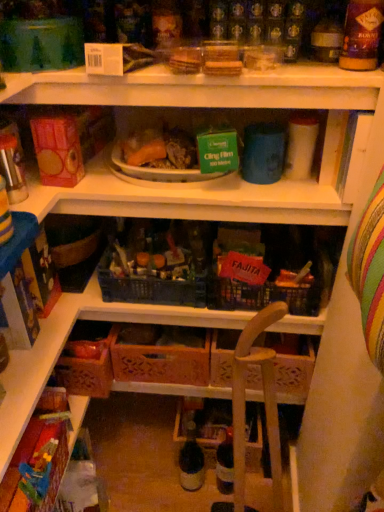
Question: Would you say translucent glass bottle at center contains orange plastic bowl at center?

Choices:
 (A) yes
 (B) no

Answer: (B)

Question: From the image's perspective, is translucent glass bottle at center located beneath orange plastic bowl at center?

Choices:
 (A) no
 (B) yes

Answer: (B)

Question: Does translucent glass bottle at center appear on the right side of orange plastic bowl at center?

Choices:
 (A) yes
 (B) no

Answer: (A)

Question: Is translucent glass bottle at center bigger than orange plastic bowl at center?

Choices:
 (A) yes
 (B) no

Answer: (B)

Question: Is translucent glass bottle at center turned away from orange plastic bowl at center?

Choices:
 (A) no
 (B) yes

Answer: (A)

Question: Could you tell me if translucent glass bottle at center is facing orange plastic bowl at center?

Choices:
 (A) yes
 (B) no

Answer: (B)

Question: Are white plastic plate at upper center and multicolored fabric toy at lower left beside each other?

Choices:
 (A) no
 (B) yes

Answer: (A)

Question: Considering the relative positions of white plastic plate at upper center and multicolored fabric toy at lower left in the image provided, is white plastic plate at upper center to the left of multicolored fabric toy at lower left from the viewer's perspective?

Choices:
 (A) no
 (B) yes

Answer: (A)

Question: From the image's perspective, would you say white plastic plate at upper center is positioned over multicolored fabric toy at lower left?

Choices:
 (A) no
 (B) yes

Answer: (B)

Question: Is white plastic plate at upper center taller than multicolored fabric toy at lower left?

Choices:
 (A) no
 (B) yes

Answer: (A)

Question: Would you say white plastic plate at upper center is outside multicolored fabric toy at lower left?

Choices:
 (A) yes
 (B) no

Answer: (A)

Question: Would you say multicolored fabric toy at lower left is part of white plastic plate at upper center's contents?

Choices:
 (A) no
 (B) yes

Answer: (A)

Question: Is multicolored fabric toy at lower left not close to white plastic plate at upper center?

Choices:
 (A) no
 (B) yes

Answer: (A)